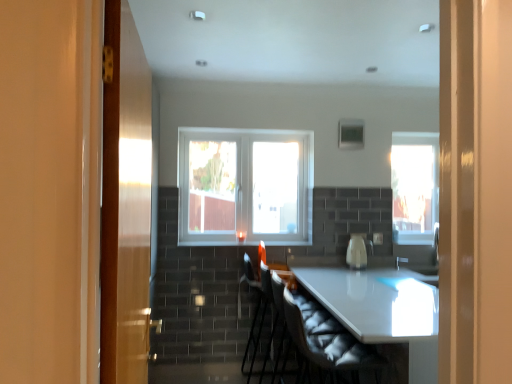
You are a GUI agent. You are given a task and a screenshot of the screen. Output one action in this format:
    pyautogui.click(x=<x>, y=<y>)
    Task: Click on the free space below white glossy kettle at center (from a real-world perspective)
    
    Given the screenshot: What is the action you would take?
    pyautogui.click(x=357, y=263)